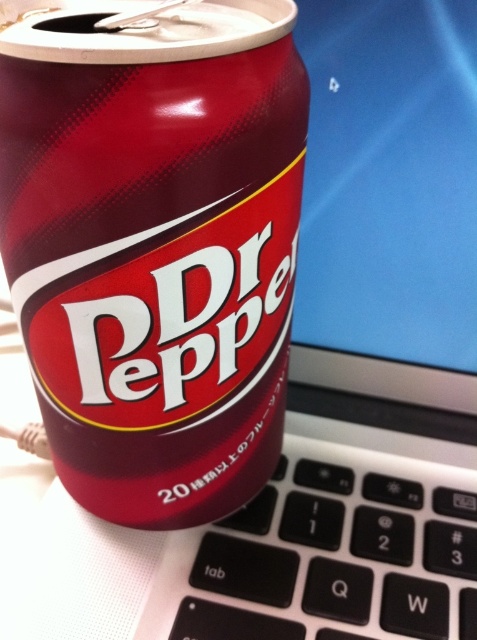
You are trying to type a document on your laptop but notice the glossy metallic can at center and the black plastic keyboard at lower center. Which object is blocking your view of the keyboard keys?

The glossy metallic can at center is positioned on the left side of the black plastic keyboard at lower center, so it might be blocking part of the keyboard keys.

You are trying to place a new sticker on your laptop keyboard. The sticker is 2 cm wide. Where should you place it so that it doesn not overlap with the glossy metallic can at center?

The glossy metallic can at center is located at point (154,243). To avoid overlapping, place the sticker at least 2 cm away from these coordinates in any direction.

You are trying to type on the black plastic keyboard at lower center but there is a glossy metallic can at center in the way. Can you still reach the keyboard without moving the can?

The glossy metallic can at center is closer to the viewer than the black plastic keyboard at lower center, so it is blocking access to the keyboard. You would need to move the can to reach the keyboard.